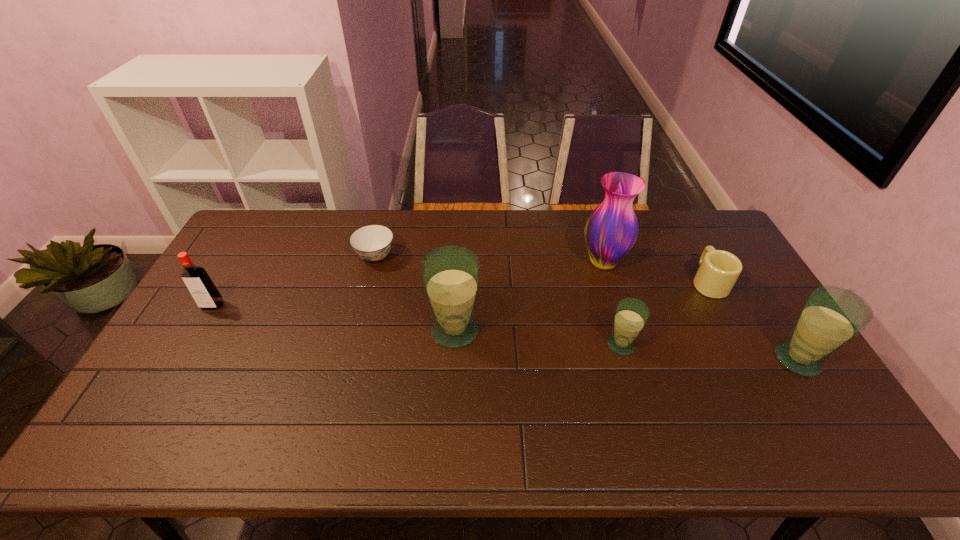
At what (x,y) coordinates should I click in order to perform the action: click on free location located on the front and back of the fourth farthest object. Please return your answer as a coordinate pair (x, y). Looking at the image, I should click on (185, 352).

Identify the location of vase that is positioned at the far edge. (611, 230).

Locate an element on the screen. This screenshot has width=960, height=540. soup bowl that is at the far edge is located at coordinates (372, 243).

This screenshot has height=540, width=960. Find the location of `object present at the left edge`. object present at the left edge is located at coordinates (204, 292).

Where is `glass that is at the right edge`? This screenshot has height=540, width=960. glass that is at the right edge is located at coordinates (831, 316).

Image resolution: width=960 pixels, height=540 pixels. Find the location of `mug located at the right edge`. mug located at the right edge is located at coordinates (719, 270).

The height and width of the screenshot is (540, 960). In the image, there is a desktop. Identify the location of free region at the far edge. (396, 224).

Where is `free spot at the near edge of the desktop`? The width and height of the screenshot is (960, 540). free spot at the near edge of the desktop is located at coordinates (486, 397).

In the image, there is a desktop. Identify the location of free region at the left edge. (241, 269).

In the image, there is a desktop. At what (x,y) coordinates should I click in order to perform the action: click on vacant space at the right edge. Please return your answer as a coordinate pair (x, y). The width and height of the screenshot is (960, 540). Looking at the image, I should click on (758, 338).